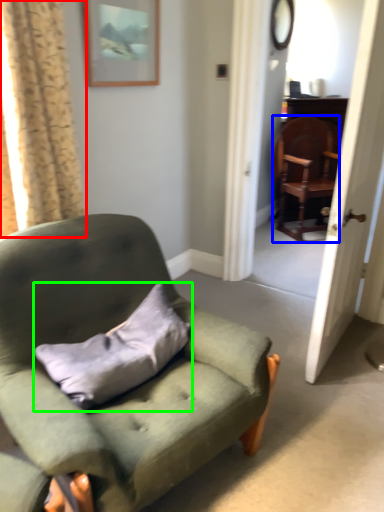
Question: Estimate the real-world distances between objects in this image. Which object is closer to curtain (highlighted by a red box), chair (highlighted by a blue box) or pillow (highlighted by a green box)?

Choices:
 (A) chair
 (B) pillow

Answer: (B)